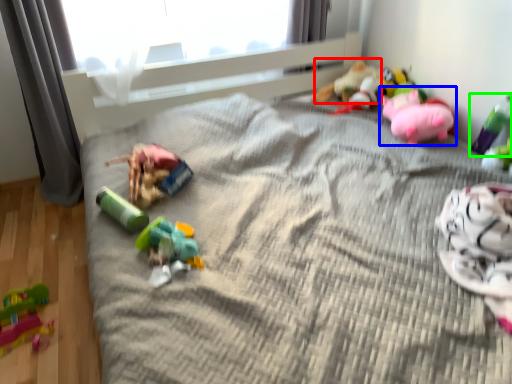
Question: Which object is the closest to the toy (highlighted by a red box)? Choose among these: toy (highlighted by a blue box) or toy (highlighted by a green box).

Choices:
 (A) toy
 (B) toy

Answer: (A)